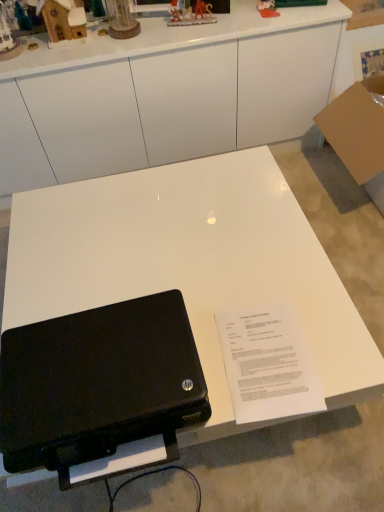
Image resolution: width=384 pixels, height=512 pixels. Identify the location of empty space that is in between black matte laptop at lower left and white paper at center. (211, 360).